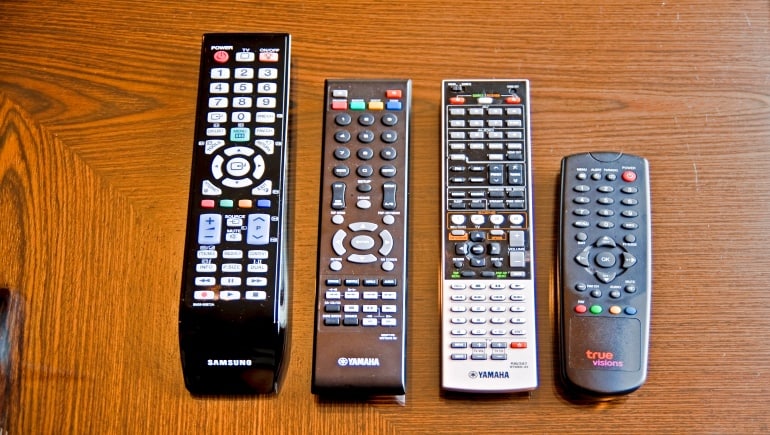
The image size is (770, 435). I want to click on samsung remote control, so coord(258,339).